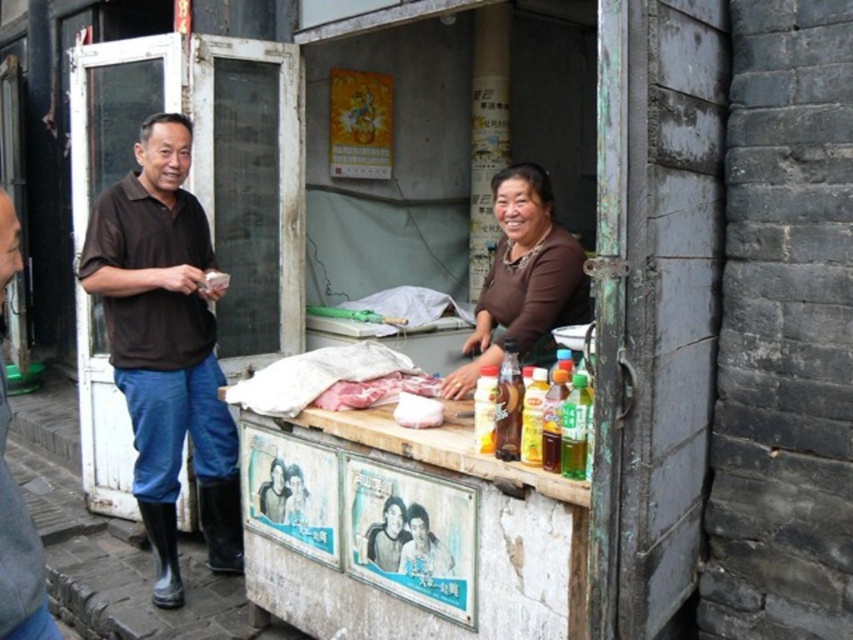
You are a customer at the stall and want to pick up both the brown cotton shirt at left and the brown matte shirt at center. If your arms are 2 feet long, can you reach both shirts at the same time without moving your body?

The brown cotton shirt at left and brown matte shirt at center are 4.63 feet apart from each other. Since your arms are only 2 feet long, you cannot reach both shirts simultaneously without moving your body.

You are a customer at the stall and want to choose between the brown cotton shirt at left and the brown matte shirt at center. Which one is taller?

The brown cotton shirt at left is much taller than the brown matte shirt at center.

You are a customer at the stall and want to grab the brown cotton shirt at left and brown leather jacket at left. The stall owner says you can only take one item. If you can only reach items within 5 feet, which one can you take?

The brown cotton shirt at left is 5.01 feet from brown leather jacket at left. Since you can only reach items within 5 feet, neither item is within reach as the distance between them is slightly over 5 feet.